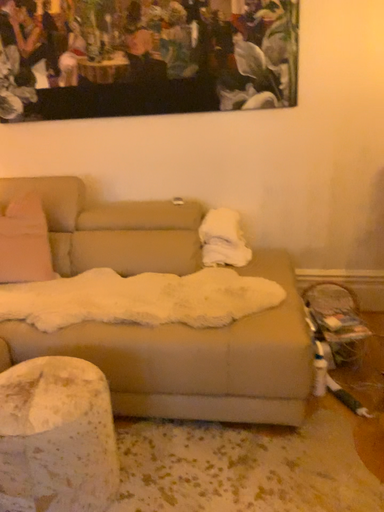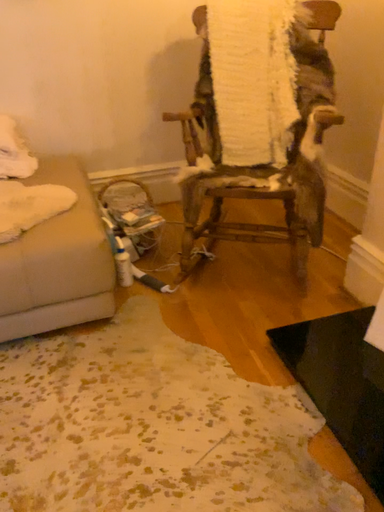
Question: How did the camera likely rotate when shooting the video?

Choices:
 (A) rotated right
 (B) rotated left

Answer: (A)